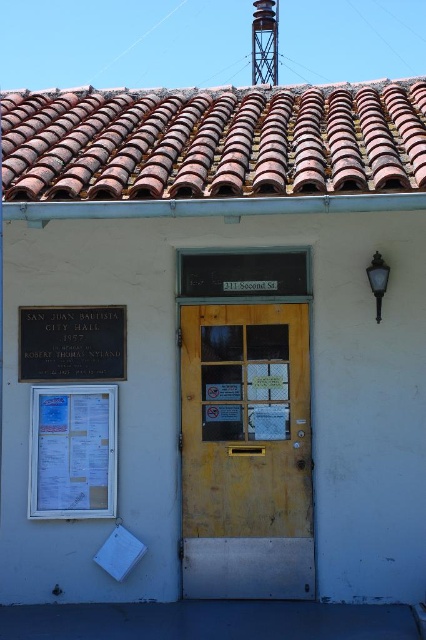
Question: Which object is positioned closest to the terracotta tiles at top?

Choices:
 (A) white paper at left
 (B) yellow wood door at center
 (C) metallic plaque at left

Answer: (C)

Question: Does yellow wood door at center appear on the right side of white paper at left?

Choices:
 (A) yes
 (B) no

Answer: (A)

Question: Which of the following is the farthest from the observer?

Choices:
 (A) (97, 406)
 (B) (273, 44)
 (C) (92, 198)

Answer: (B)

Question: Is yellow wood door at center positioned in front of metallic lattice water tower at upper center?

Choices:
 (A) no
 (B) yes

Answer: (B)

Question: Can you confirm if terracotta tiles at top is positioned above metallic lattice water tower at upper center?

Choices:
 (A) yes
 (B) no

Answer: (B)

Question: Which object is farther from the camera taking this photo?

Choices:
 (A) terracotta tiles at top
 (B) yellow wood door at center
 (C) white paper at left

Answer: (B)